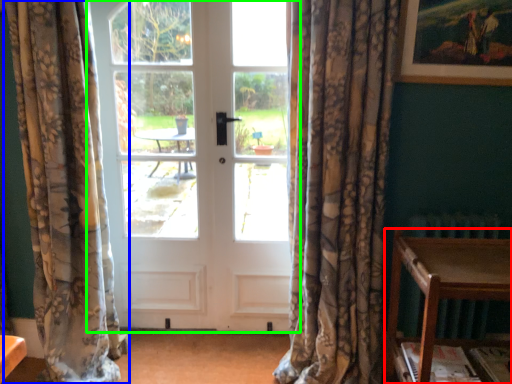
Question: Which object is positioned farthest from table (highlighted by a red box)? Select from curtain (highlighted by a blue box) and door (highlighted by a green box).

Choices:
 (A) curtain
 (B) door

Answer: (A)